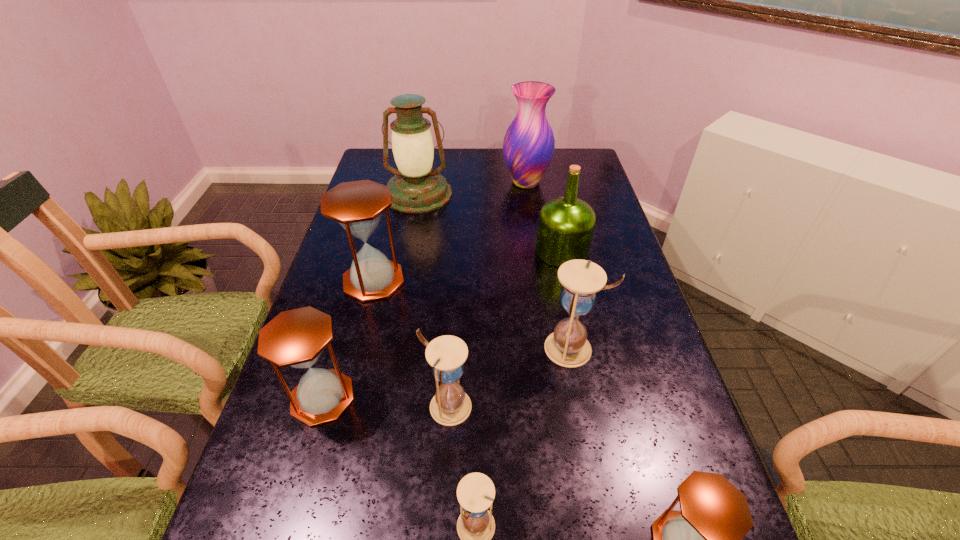
Where is `vase`? The width and height of the screenshot is (960, 540). vase is located at coordinates (529, 144).

The width and height of the screenshot is (960, 540). In order to click on lantern in this screenshot , I will do `click(416, 188)`.

Find the location of a particular element. This screenshot has height=540, width=960. olive oil is located at coordinates (566, 224).

Identify the location of the farthest brown hourglass. The width and height of the screenshot is (960, 540). (357, 206).

Where is `the farthest hourglass`? the farthest hourglass is located at coordinates (357, 206).

Where is `the biggest white hourglass`? The width and height of the screenshot is (960, 540). the biggest white hourglass is located at coordinates (567, 346).

Where is `the second hourglass from right to left`? The height and width of the screenshot is (540, 960). the second hourglass from right to left is located at coordinates [567, 346].

Where is `the second farthest brown hourglass`? This screenshot has width=960, height=540. the second farthest brown hourglass is located at coordinates (296, 338).

You are a GUI agent. You are given a task and a screenshot of the screen. Output one action in this format:
    pyautogui.click(x=<x>, y=<y>)
    Task: Click on the second farthest white hourglass
    The height and width of the screenshot is (540, 960).
    Given the screenshot: What is the action you would take?
    pyautogui.click(x=450, y=406)

Where is `blank space located 0.200m on the front of the vase`? blank space located 0.200m on the front of the vase is located at coordinates (533, 230).